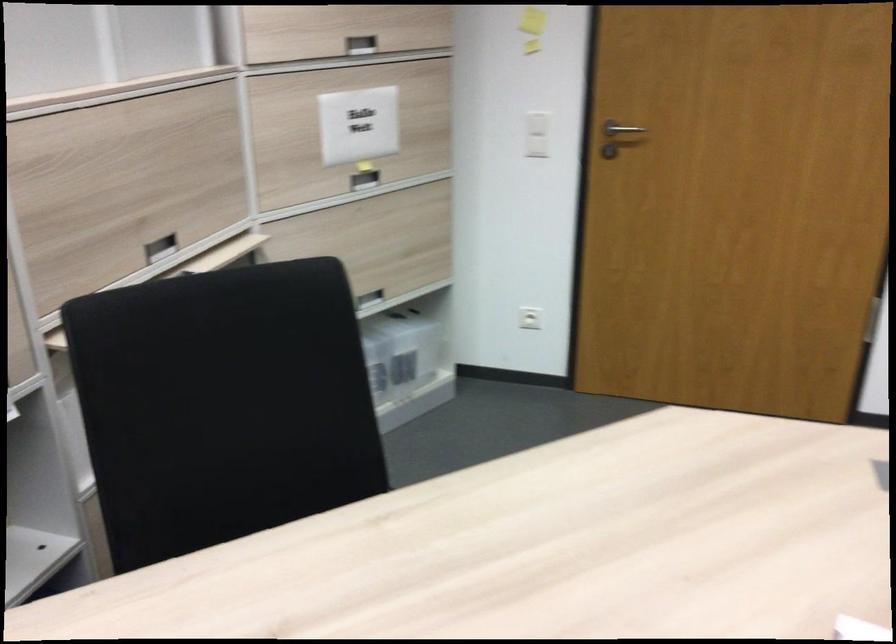
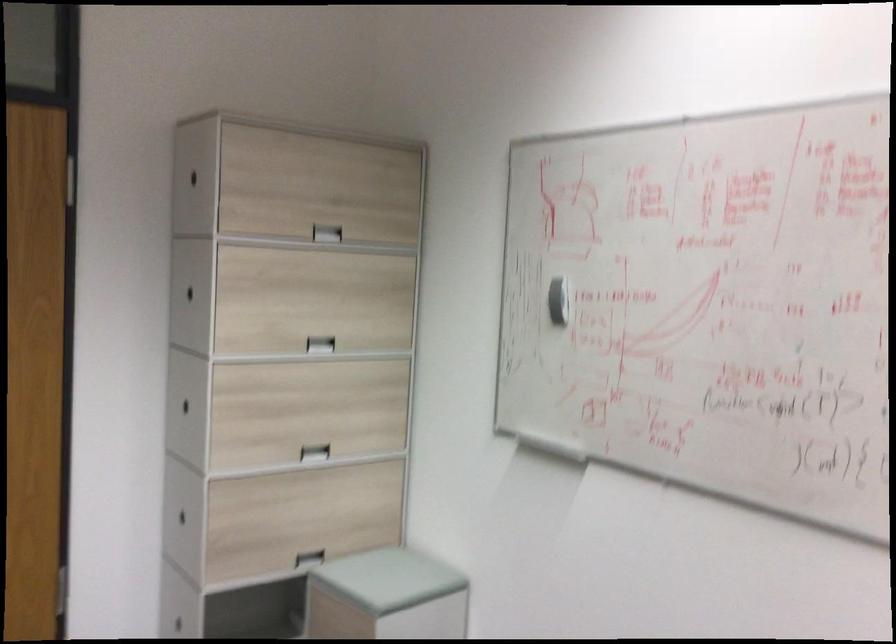
Question: The images are taken continuously from a first-person perspective. In which direction is your viewpoint rotating?

Choices:
 (A) Left
 (B) Right
 (C) Up
 (D) Down

Answer: (B)